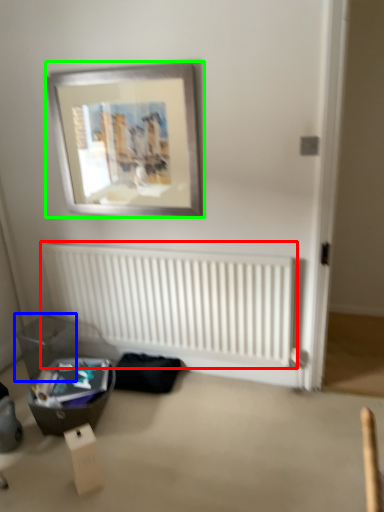
Question: Estimate the real-world distances between objects in this image. Which object is closer to radiator (highlighted by a red box), storage box (highlighted by a blue box) or picture frame (highlighted by a green box)?

Choices:
 (A) storage box
 (B) picture frame

Answer: (A)